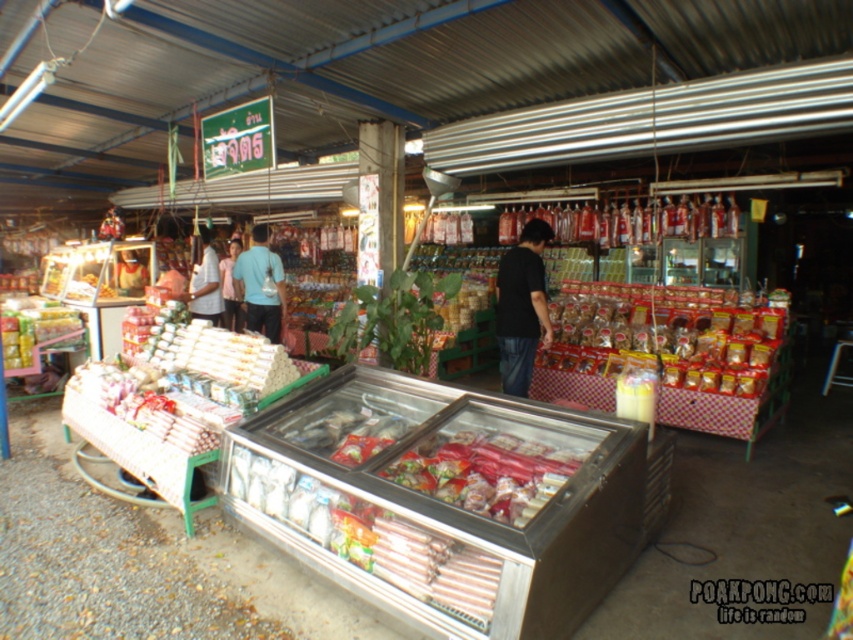
You are standing in the market and want to reach the two points marked in the scene. Which point, point (779,348) or point (231,285), is closer to you?

Point (779,348) is closer to the viewer than point (231,285).

You are a customer in the market and want to buy a shirt. You see the white matte shirt at center and the light blue shirt at center. Which shirt is wider?

The white matte shirt at center is wider than the light blue shirt at center.

You are a customer holding a shopping basket that can only hold items within a 2 meter radius. You want to pick up both the matte brown bread at center right and the translucent plastic meat at center. Can you reach both items without moving your basket?

The distance between the matte brown bread at center right and the translucent plastic meat at center is 2.79 meters, which is beyond the 2 meter radius of your basket. Therefore, you cannot reach both items without moving your basket.